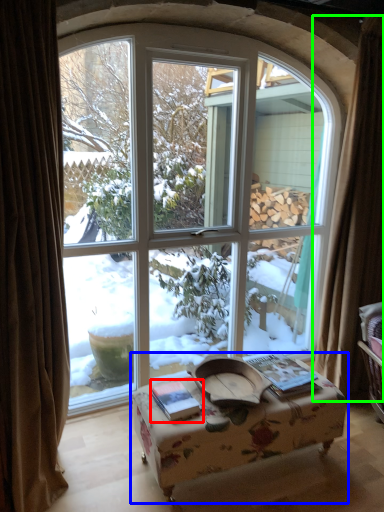
Question: Based on their relative distances, which object is nearer to book (highlighted by a red box)? Choose from table (highlighted by a blue box) and curtain (highlighted by a green box).

Choices:
 (A) table
 (B) curtain

Answer: (A)